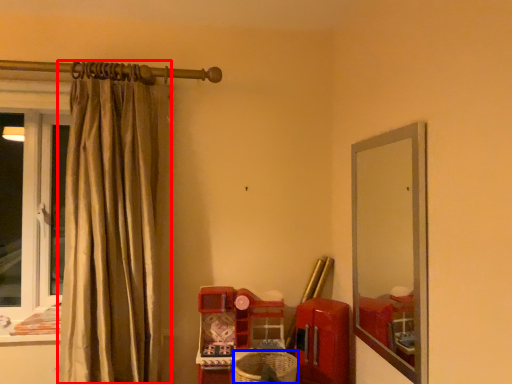
Question: Among these objects, which one is nearest to the camera, curtain (highlighted by a red box) or basket (highlighted by a blue box)?

Choices:
 (A) curtain
 (B) basket

Answer: (A)